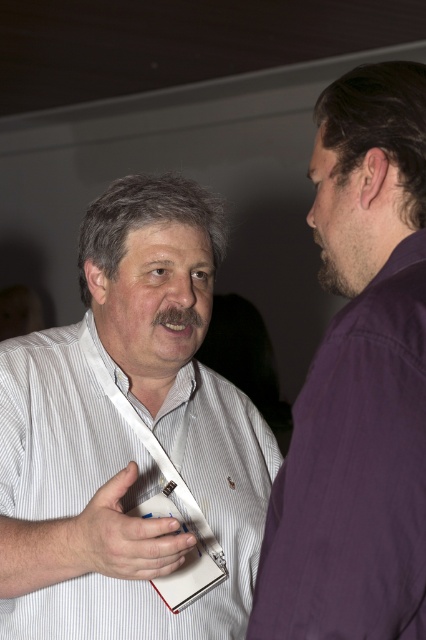
In the scene shown: Can you confirm if purple cotton shirt at right is smaller than white paper at center?

No, purple cotton shirt at right is not smaller than white paper at center.

Between purple cotton shirt at right and white paper at center, which one appears on the left side from the viewer's perspective?

From the viewer's perspective, white paper at center appears more on the left side.

You are a GUI agent. You are given a task and a screenshot of the screen. Output one action in this format:
    pyautogui.click(x=<x>, y=<y>)
    Task: Click on the purple cotton shirt at right
    The width and height of the screenshot is (426, 640).
    Given the screenshot: What is the action you would take?
    pyautogui.click(x=359, y=381)

Is white striped shirt at center shorter than purple cotton shirt at right?

No.

Find the location of a particular element. This screenshot has height=640, width=426. white striped shirt at center is located at coordinates (129, 436).

Between point (95, 504) and point (379, 522), which one is positioned behind?

The point (95, 504) is behind.

Image resolution: width=426 pixels, height=640 pixels. In order to click on white striped shirt at center in this screenshot , I will do `click(129, 436)`.

In the scene shown: Who is positioned more to the right, white striped shirt at center or white paper at center?

Positioned to the right is white striped shirt at center.

Is white striped shirt at center smaller than white paper at center?

No, white striped shirt at center is not smaller than white paper at center.

I want to click on white striped shirt at center, so click(129, 436).